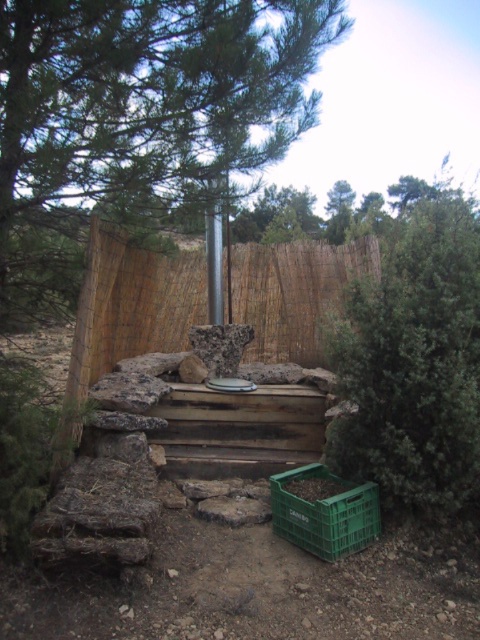
You are standing at the edge of the wooden platform and see the green leafy tree at center and the green plastic crate at lower center. Which object is higher from the ground?

The green leafy tree at center is above the green plastic crate at lower center, so the green leafy tree at center is higher from the ground.

Looking at this image, you are standing in the rustic outdoor setting described. You notice a green leafy tree at right and a metallic pole at center. Which object is taller?

The green leafy tree at right is taller than the metallic pole at center.

You are standing at the edge of the wooden platform and need to place a 5.5 feet long ladder between the green leafy tree at center and the green plastic crate at lower center. Will the ladder fit horizontally between them without bending?

The distance between the green leafy tree at center and the green plastic crate at lower center is 7.87 feet. Since the ladder is 5.5 feet long, it will fit horizontally between them without bending.